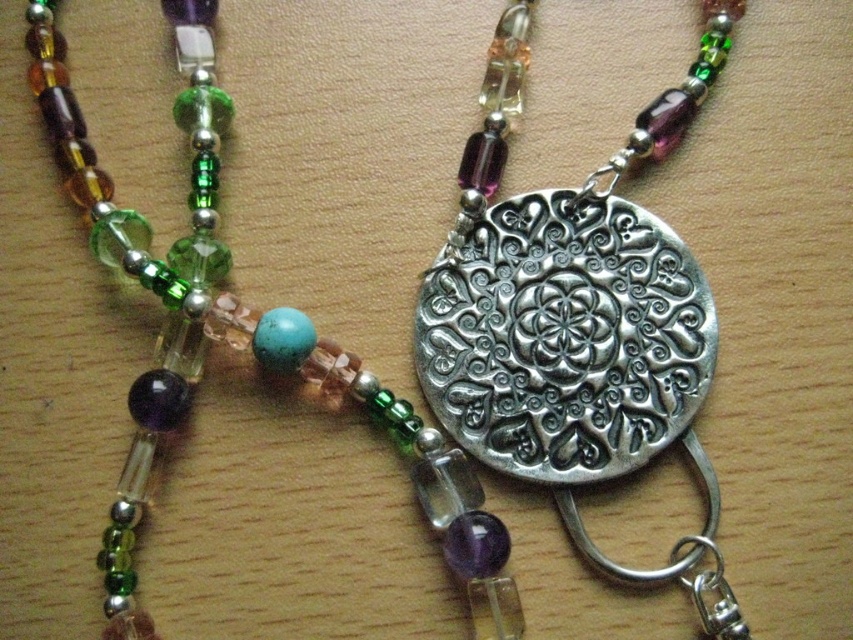
Question: Is silver textured medallion at center positioned in front of matte silver medallion at center?

Choices:
 (A) yes
 (B) no

Answer: (A)

Question: Which object appears closest to the camera in this image?

Choices:
 (A) matte silver medallion at center
 (B) silver textured medallion at center

Answer: (B)

Question: Is silver textured medallion at center thinner than matte silver medallion at center?

Choices:
 (A) yes
 (B) no

Answer: (A)

Question: Is silver textured medallion at center smaller than matte silver medallion at center?

Choices:
 (A) no
 (B) yes

Answer: (B)

Question: Which point appears farthest from the camera in this image?

Choices:
 (A) (454, 573)
 (B) (463, 163)

Answer: (B)